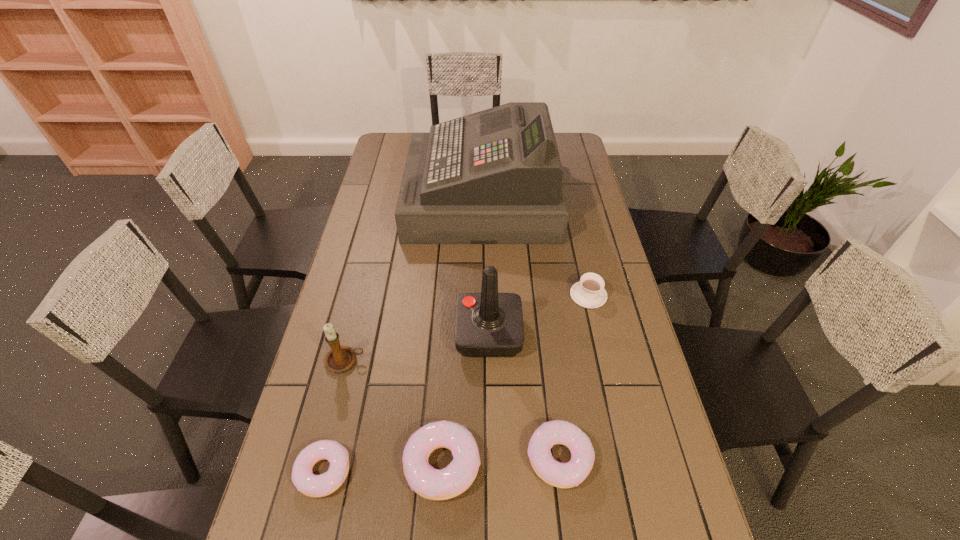
The image size is (960, 540). I want to click on vacant position located 0.390m on the right of the second doughnut from left to right, so click(x=648, y=464).

Identify the location of vacant area located 0.340m on the left of the second tallest doughnut. The width and height of the screenshot is (960, 540). (382, 457).

Find the location of `vacant area situated 0.070m on the front-facing side of the farthest object`. vacant area situated 0.070m on the front-facing side of the farthest object is located at coordinates (391, 198).

The height and width of the screenshot is (540, 960). I want to click on free space located on the front-facing side of the farthest object, so click(x=383, y=198).

At what (x,y) coordinates should I click in order to perform the action: click on free spot located on the front-facing side of the farthest object. Please return your answer as a coordinate pair (x, y). Image resolution: width=960 pixels, height=540 pixels. Looking at the image, I should click on (396, 198).

You are a GUI agent. You are given a task and a screenshot of the screen. Output one action in this format:
    pyautogui.click(x=<x>, y=<y>)
    Task: Click on the vacant area situated on the left of the joystick
    The height and width of the screenshot is (540, 960).
    Given the screenshot: What is the action you would take?
    pyautogui.click(x=388, y=334)

Where is `vacant space situated on the side of the candle holder with the handle`? The height and width of the screenshot is (540, 960). vacant space situated on the side of the candle holder with the handle is located at coordinates (401, 361).

At what (x,y) coordinates should I click in order to perform the action: click on free space located 0.160m on the handle side of the second farthest object. Please return your answer as a coordinate pair (x, y). Image resolution: width=960 pixels, height=540 pixels. Looking at the image, I should click on (578, 248).

Locate an element on the screen. The width and height of the screenshot is (960, 540). vacant space located 0.250m on the handle side of the second farthest object is located at coordinates (574, 232).

In order to click on vacant region located on the handle side of the second farthest object in this screenshot , I will do `click(574, 234)`.